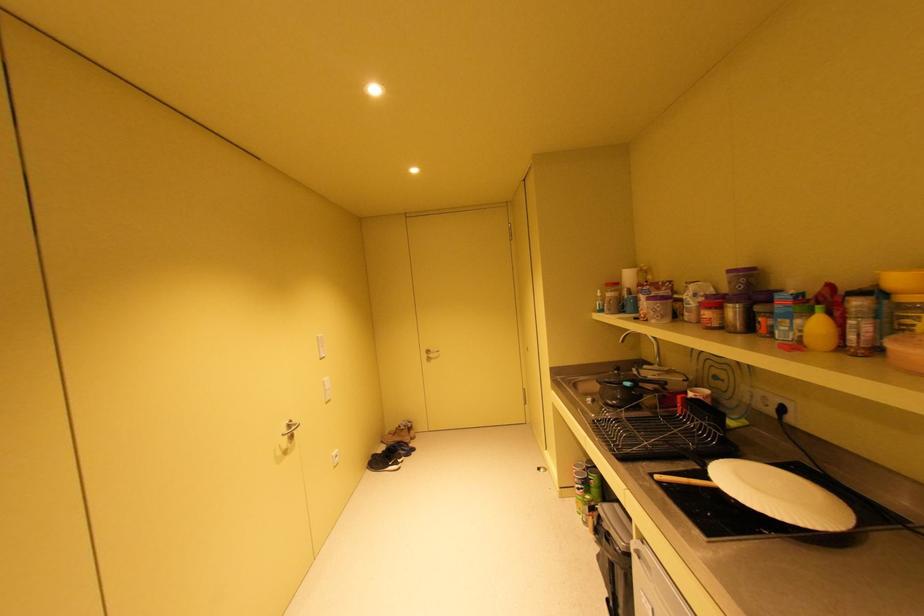
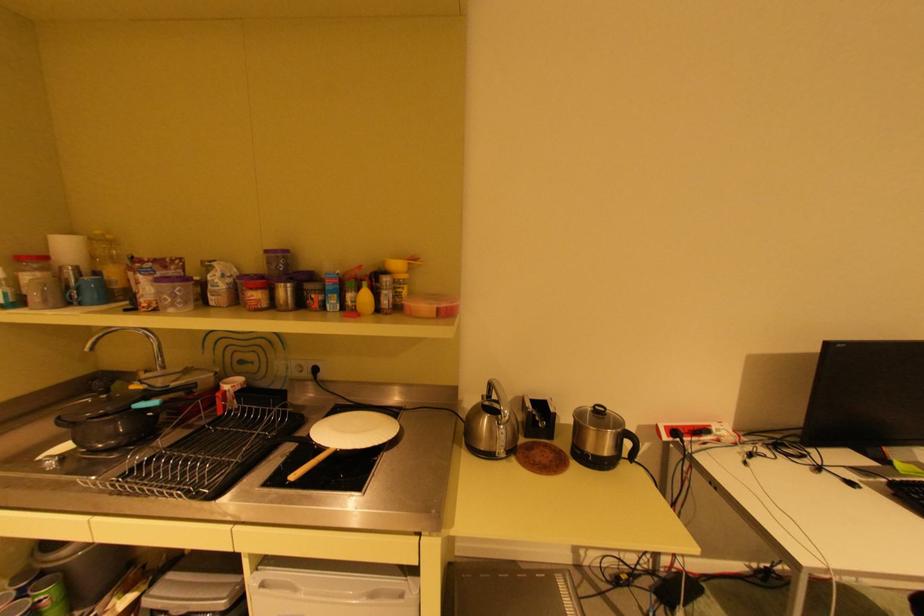
The point at (715, 477) is marked in the first image. Where is the corresponding point in the second image?

(330, 448)